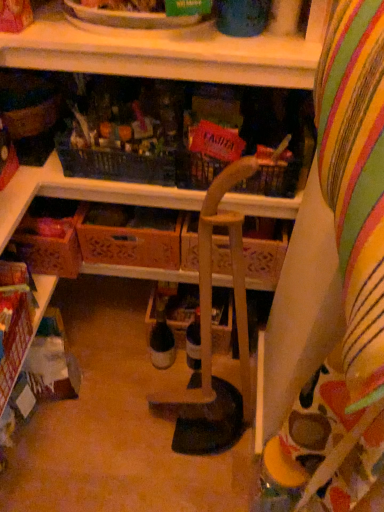
In order to click on free space below wooden crate at lower left, acting as the first drawer starting from the left (from a real-world perspective) in this screenshot , I will do tap(80, 317).